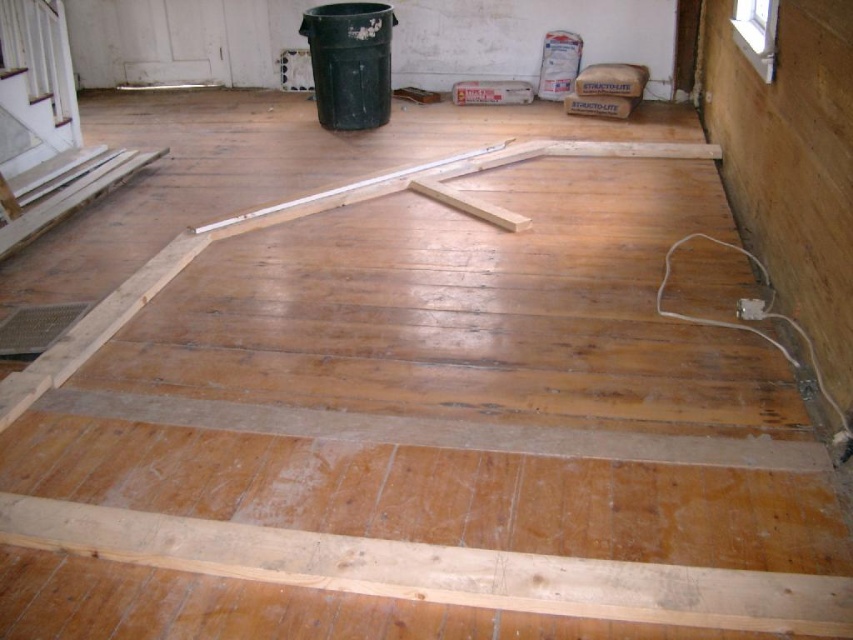
Question: Considering the relative positions of natural wood plank at bottom and light wood/rough beam at center in the image provided, where is natural wood plank at bottom located with respect to light wood/rough beam at center?

Choices:
 (A) below
 (B) above

Answer: (A)

Question: Among these objects, which one is farthest from the camera?

Choices:
 (A) light wood/rough beam at center
 (B) natural wood plank at bottom

Answer: (A)

Question: Is natural wood plank at bottom wider than light wood/rough beam at center?

Choices:
 (A) yes
 (B) no

Answer: (A)

Question: Which point is farther from the camera taking this photo?

Choices:
 (A) (459, 163)
 (B) (521, 577)

Answer: (A)

Question: Can you confirm if natural wood plank at bottom is positioned to the left of light wood/rough beam at center?

Choices:
 (A) yes
 (B) no

Answer: (B)

Question: Which of the following is the closest to the observer?

Choices:
 (A) light wood/rough beam at center
 (B) natural wood plank at bottom

Answer: (B)